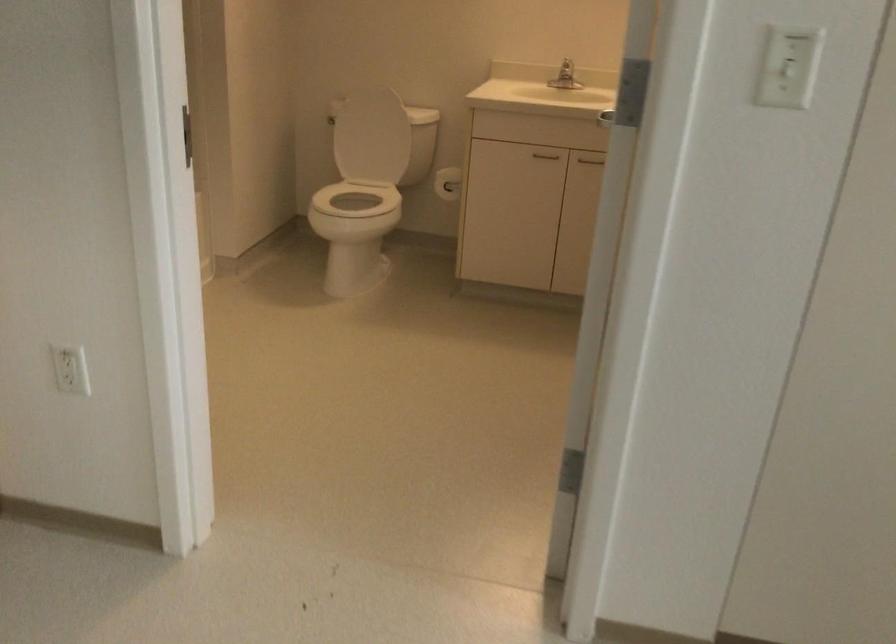
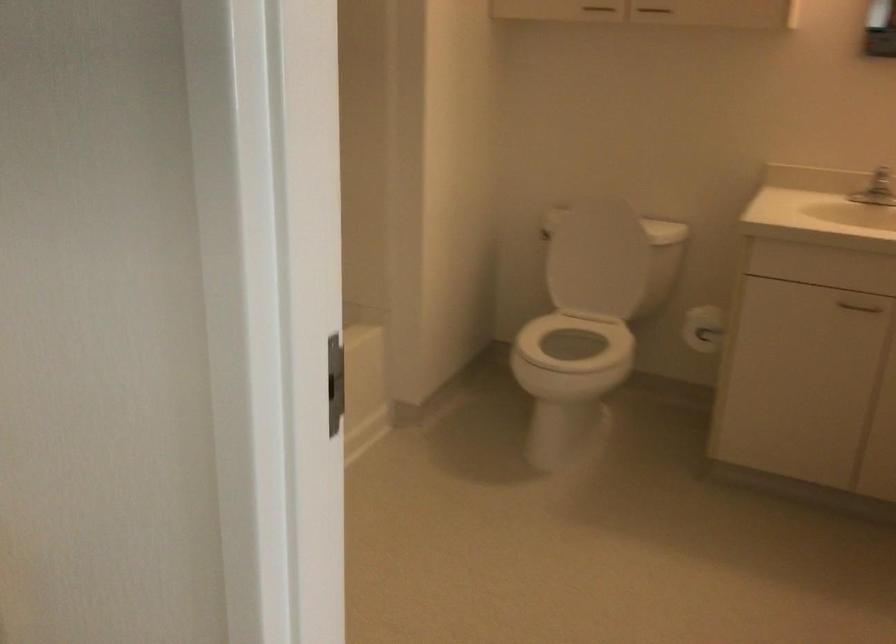
Question: I am providing you with two images of the same scene from different viewpoints. Please identify which objects are invisible in image2.

Choices:
 (A) upper cabinet handle
 (B) vanity cabinet handle
 (C) white toilet lid
 (D) none of these

Answer: (D)